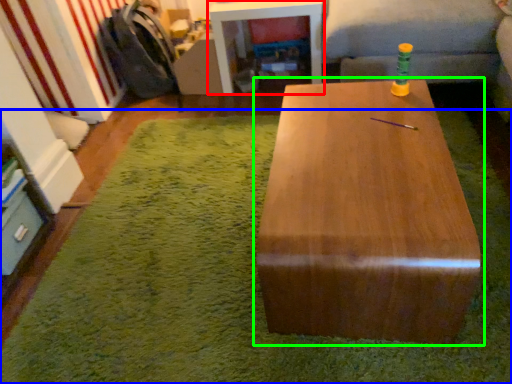
Question: Considering the real-world distances, which object is closest to table (highlighted by a red box)? mat (highlighted by a blue box) or table (highlighted by a green box).

Choices:
 (A) mat
 (B) table

Answer: (A)